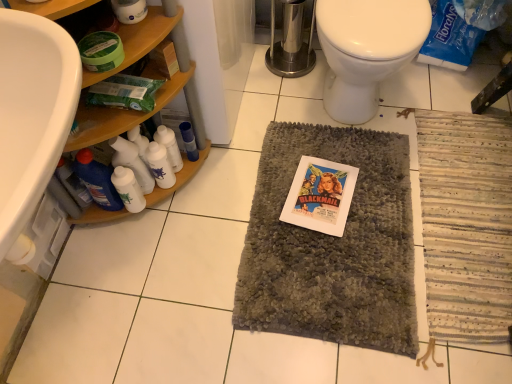
Find the location of a particular element. This screenshot has width=512, height=384. vacant space that is in between blue glossy bottle at lower left, which is the 5th bottle from right to left, and gray shaggy mat at center is located at coordinates (207, 215).